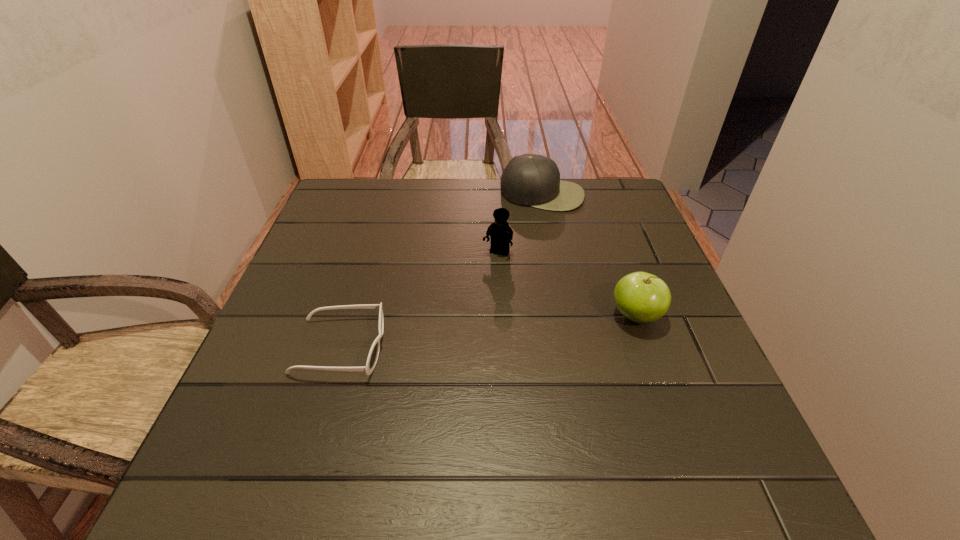
Locate an element on the screen. This screenshot has height=540, width=960. vacant spot on the desktop that is between the shortest object and the apple and is positioned on the front-facing side of the third nearest object is located at coordinates pos(458,334).

Locate an element on the screen. This screenshot has width=960, height=540. free spot on the desktop that is between the sunglasses and the apple and is positioned on the brim of the cap is located at coordinates (502, 330).